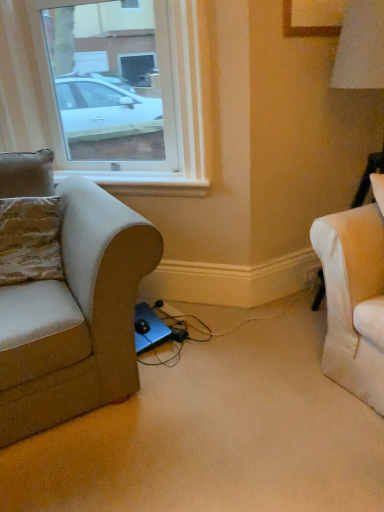
Question: From their relative heights in the image, would you say textured beige pillow at left is taller or shorter than transparent glass window at upper left?

Choices:
 (A) tall
 (B) short

Answer: (B)

Question: Considering the positions of textured beige pillow at left and transparent glass window at upper left in the image, is textured beige pillow at left wider or thinner than transparent glass window at upper left?

Choices:
 (A) thin
 (B) wide

Answer: (A)

Question: Which object is the closest to the textured beige pillow at left?

Choices:
 (A) matte beige couch at left
 (B) transparent glass window at upper left
 (C) white painted wood at center
 (D) blue metallic laptop at lower center
 (E) black plastic electric outlet at lower right

Answer: (A)

Question: Considering the real-world distances, which object is closest to the matte beige couch at left?

Choices:
 (A) black plastic electric outlet at lower right
 (B) transparent glass window at upper left
 (C) blue metallic laptop at lower center
 (D) textured beige pillow at left
 (E) white painted wood at center

Answer: (D)